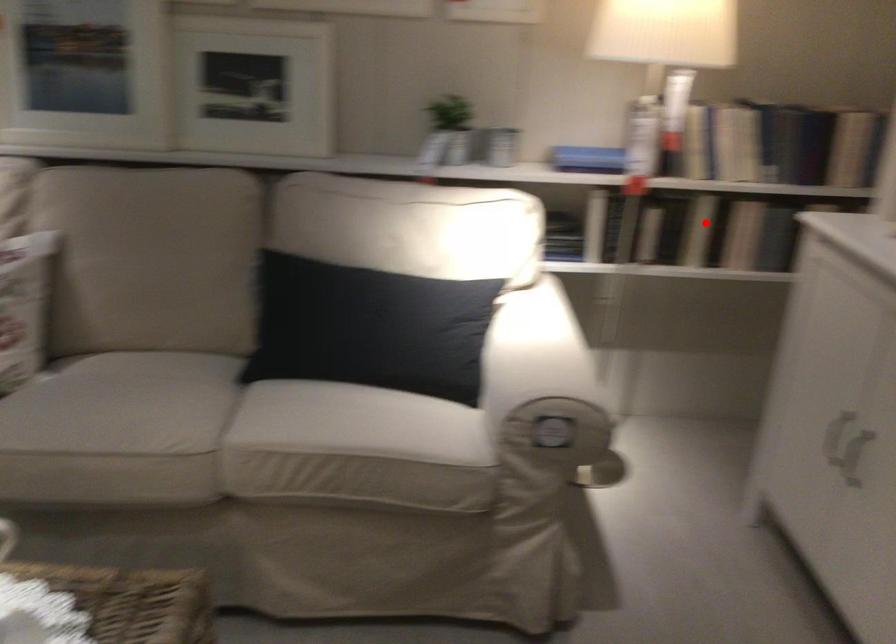
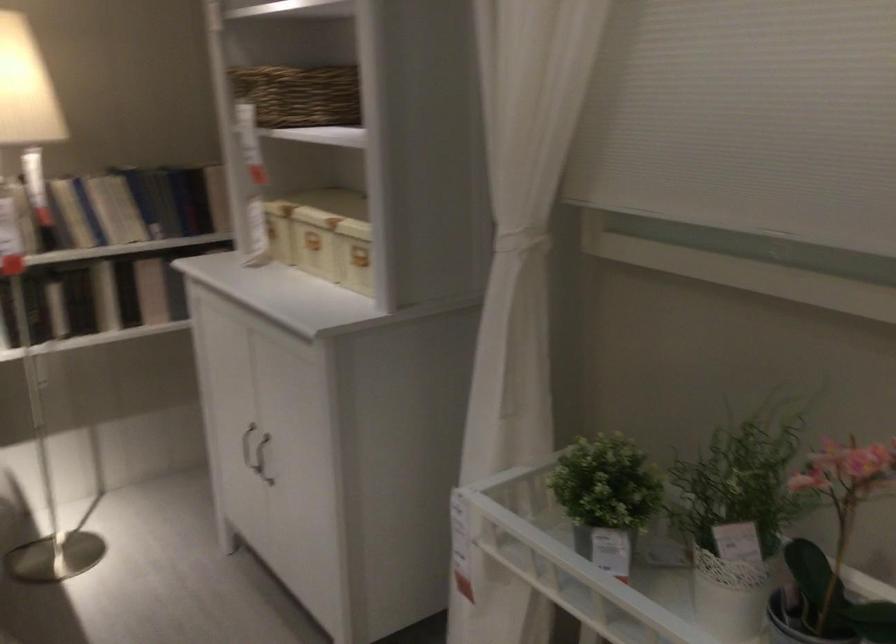
Locate, in the second image, the point that corresponds to the highlighted location in the first image.

(105, 296)